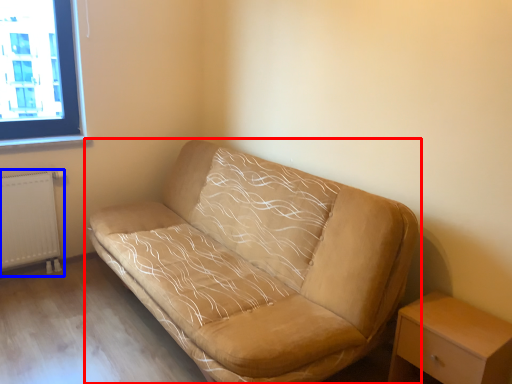
Question: Which of the following is the closest to the observer, studio couch (highlighted by a red box) or radiator (highlighted by a blue box)?

Choices:
 (A) studio couch
 (B) radiator

Answer: (A)